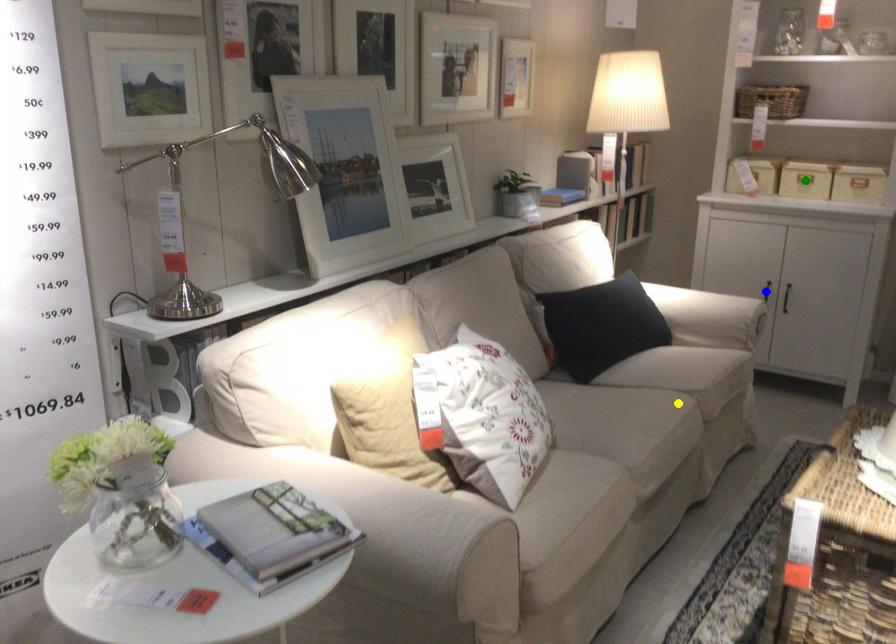
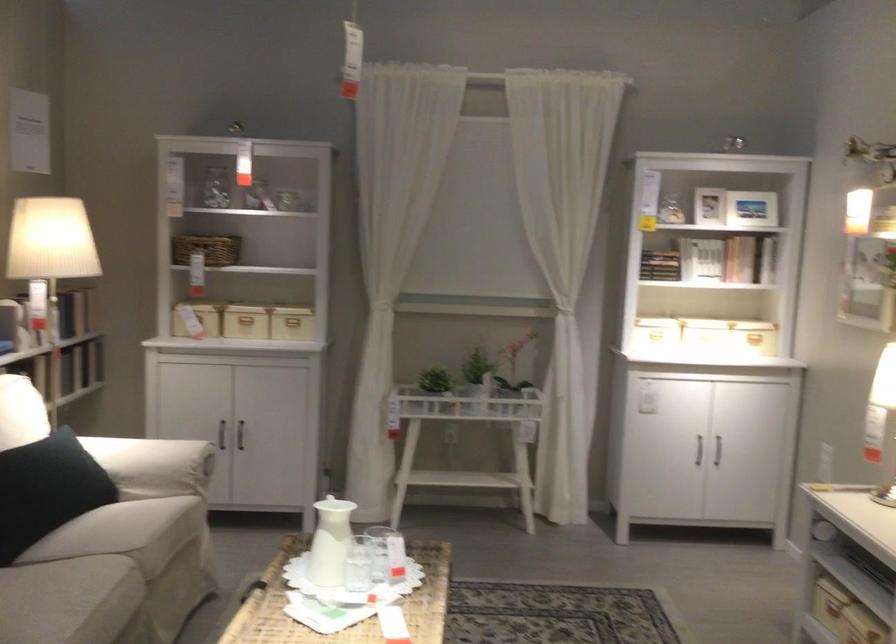
I am providing you with two images of the same scene from different viewpoints. Three points are marked in image1. Which point corresponds to a part or object that is occluded in image2?In image1, three points are marked. Which of them correspond to a part or object that is occluded in image2?Among the three points shown in image1, which one corresponds to a part or object that is no longer visible due to occlusion in image2?

blue point, green point cannot be seen in image2.